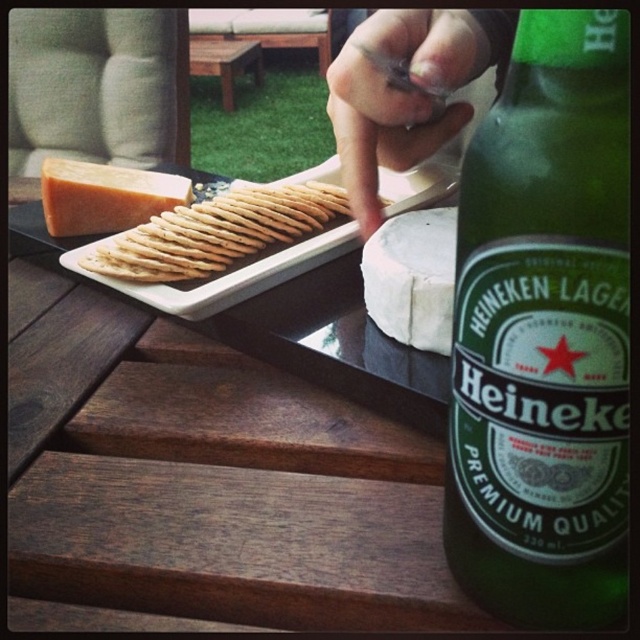
You are a food delivery person who just arrived at the location. You need to place a small dessert plate between the golden crisp crackers at center left and the white creamy cheese at center. Can you fit it there?

The golden crisp crackers at center left is further to the viewer than white creamy cheese at center, so there is space between them to place the dessert plate.

You are a photographer trying to capture a closeup shot of the Heineken bottle. You notice a smooth skin hand at upper center in the frame. Based on the distance between them, can you estimate whether the hand will be in focus if you focus on the bottle?

The smooth skin hand at upper center and viewer are 11.63 inches apart from each other. If you focus on the Heineken bottle, the hand at upper center may or may not be in focus depending on the camera aperture and depth of field. However, since they are 11.63 inches apart, there is a possibility the hand could be slightly out of focus if the depth of field is narrow.

You are a guest at this outdoor gathering and want to reach for the white creamy cheese at center. Since the wooden table at center is between you and the cheese, can you easily access it without moving the table?

The wooden table at center is located below the white creamy cheese at center, so the cheese is on the table. You can easily access the white creamy cheese at center by reaching over or around the table.